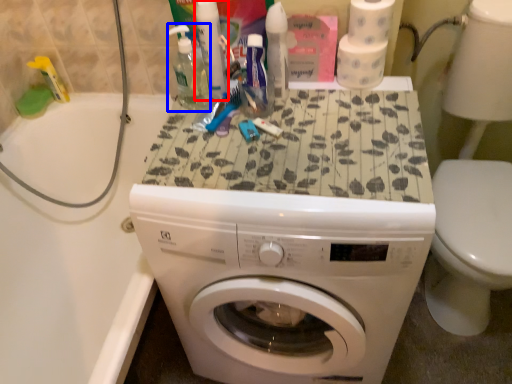
Question: Which object is closer to the camera taking this photo, toiletry (highlighted by a red box) or cleaning product (highlighted by a blue box)?

Choices:
 (A) toiletry
 (B) cleaning product

Answer: (B)